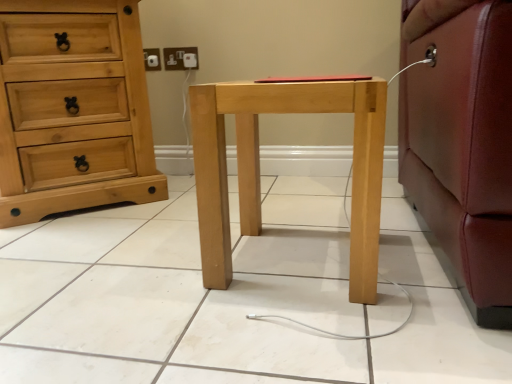
This screenshot has height=384, width=512. In order to click on white plastic electric outlet at upper center in this screenshot , I will do `click(181, 58)`.

Where is `white plastic electric outlet at upper center`? white plastic electric outlet at upper center is located at coordinates (181, 58).

Is white plastic electric outlet at upper center oriented towards natural wood nightstand at center?

No.

Is the depth of white plastic electric outlet at upper center greater than that of natural wood nightstand at center?

Yes, white plastic electric outlet at upper center is behind natural wood nightstand at center.

Is white plastic electric outlet at upper center not near natural wood nightstand at center?

No, white plastic electric outlet at upper center is in close proximity to natural wood nightstand at center.

Which is more to the left, white plastic electric outlet at upper center or natural wood nightstand at center?

Positioned to the left is white plastic electric outlet at upper center.

From the image's perspective, who appears lower, natural wood nightstand at center or white plastic electric outlet at upper center?

natural wood nightstand at center, from the image's perspective.

Considering the relative sizes of natural wood nightstand at center and white plastic electric outlet at upper center in the image provided, is natural wood nightstand at center bigger than white plastic electric outlet at upper center?

Indeed, natural wood nightstand at center has a larger size compared to white plastic electric outlet at upper center.

From a real-world perspective, is natural wood nightstand at center below white plastic electric outlet at upper center?

Yes.

In the scene shown: Can you see natural wood nightstand at center touching white plastic electric outlet at upper center?

No, natural wood nightstand at center is not in contact with white plastic electric outlet at upper center.

How many degrees apart are the facing directions of natural wood nightstand at center and natural wood chest of drawers at left?

The angle between the facing direction of natural wood nightstand at center and the facing direction of natural wood chest of drawers at left is 40.9 degrees.

Is natural wood nightstand at center positioned beyond the bounds of natural wood chest of drawers at left?

Yes, natural wood nightstand at center is located beyond the bounds of natural wood chest of drawers at left.

Based on their sizes in the image, would you say natural wood nightstand at center is bigger or smaller than natural wood chest of drawers at left?

natural wood nightstand at center is smaller than natural wood chest of drawers at left.

From a real-world perspective, who is located higher, natural wood nightstand at center or natural wood chest of drawers at left?

natural wood chest of drawers at left, from a real-world perspective.

Does point (103, 59) come farther from viewer compared to point (192, 52)?

No.

Is natural wood chest of drawers at left to the left or to the right of white plastic electric outlet at upper center in the image?

Clearly, natural wood chest of drawers at left is on the left of white plastic electric outlet at upper center in the image.

Does natural wood chest of drawers at left have a larger size compared to white plastic electric outlet at upper center?

Correct, natural wood chest of drawers at left is larger in size than white plastic electric outlet at upper center.

Measure the distance from natural wood chest of drawers at left to white plastic electric outlet at upper center.

A distance of 21.22 inches exists between natural wood chest of drawers at left and white plastic electric outlet at upper center.

Are natural wood chest of drawers at left and natural wood nightstand at center beside each other?

No, natural wood chest of drawers at left is not making contact with natural wood nightstand at center.

This screenshot has height=384, width=512. I want to click on nightstand that is in front of the natural wood chest of drawers at left, so click(x=259, y=166).

Considering the positions of objects natural wood chest of drawers at left and natural wood nightstand at center in the image provided, who is behind, natural wood chest of drawers at left or natural wood nightstand at center?

natural wood chest of drawers at left.

From a real-world perspective, between natural wood chest of drawers at left and natural wood nightstand at center, who is vertically lower?

natural wood nightstand at center.

How different are the orientations of white plastic electric outlet at upper center and natural wood chest of drawers at left in degrees?

The angular difference between white plastic electric outlet at upper center and natural wood chest of drawers at left is 39.4 degrees.

Does white plastic electric outlet at upper center have a lesser width compared to natural wood chest of drawers at left?

Indeed, white plastic electric outlet at upper center has a lesser width compared to natural wood chest of drawers at left.

Is white plastic electric outlet at upper center at the left side of natural wood chest of drawers at left?

No, white plastic electric outlet at upper center is not to the left of natural wood chest of drawers at left.

Is natural wood chest of drawers at left surrounded by white plastic electric outlet at upper center?

No, natural wood chest of drawers at left is not a part of white plastic electric outlet at upper center.

This screenshot has height=384, width=512. I want to click on nightstand that is below the white plastic electric outlet at upper center (from the image's perspective), so click(x=259, y=166).

The width and height of the screenshot is (512, 384). In order to click on electric outlet that appears above the natural wood nightstand at center (from a real-world perspective) in this screenshot , I will do point(181,58).

Considering their positions, is natural wood chest of drawers at left positioned closer to white plastic electric outlet at upper center than natural wood nightstand at center?

Based on the image, natural wood chest of drawers at left appears to be nearer to white plastic electric outlet at upper center.

When comparing their distances from natural wood chest of drawers at left, does white plastic electric outlet at upper center or natural wood nightstand at center seem closer?

white plastic electric outlet at upper center is closer to natural wood chest of drawers at left.

Estimate the real-world distances between objects in this image. Which object is further from natural wood nightstand at center, white plastic electric outlet at upper center or natural wood chest of drawers at left?

The object further to natural wood nightstand at center is white plastic electric outlet at upper center.

Looking at the image, which one is located closer to natural wood nightstand at center, natural wood chest of drawers at left or white plastic electric outlet at upper center?

natural wood chest of drawers at left lies closer to natural wood nightstand at center than the other object.

When comparing their distances from natural wood chest of drawers at left, does natural wood nightstand at center or white plastic electric outlet at upper center seem further?

natural wood nightstand at center is further to natural wood chest of drawers at left.

From the image, which object appears to be nearer to white plastic electric outlet at upper center, natural wood nightstand at center or natural wood chest of drawers at left?

The object closer to white plastic electric outlet at upper center is natural wood chest of drawers at left.

At what (x,y) coordinates should I click in order to perform the action: click on chest of drawers between natural wood nightstand at center and white plastic electric outlet at upper center along the z-axis. Please return your answer as a coordinate pair (x, y). This screenshot has width=512, height=384. Looking at the image, I should click on (71, 111).